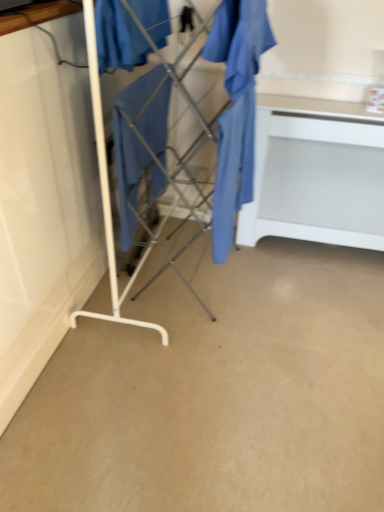
This screenshot has height=512, width=384. Find the location of `free region under metal drying rack at center (from a real-world perspective)`. free region under metal drying rack at center (from a real-world perspective) is located at coordinates (185, 275).